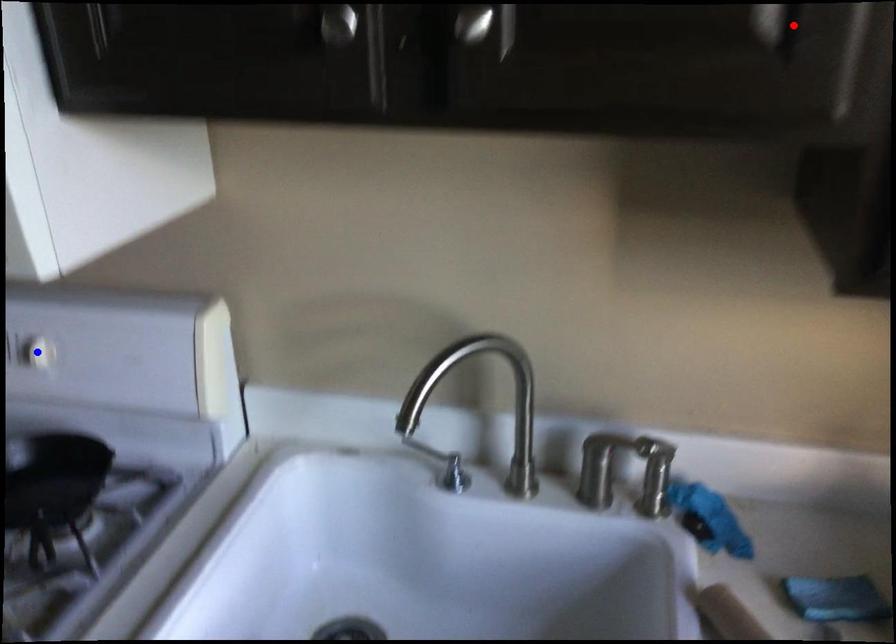
Question: Two points are marked on the image. Which point is closer to the camera?

Choices:
 (A) Blue point is closer.
 (B) Red point is closer.

Answer: (B)